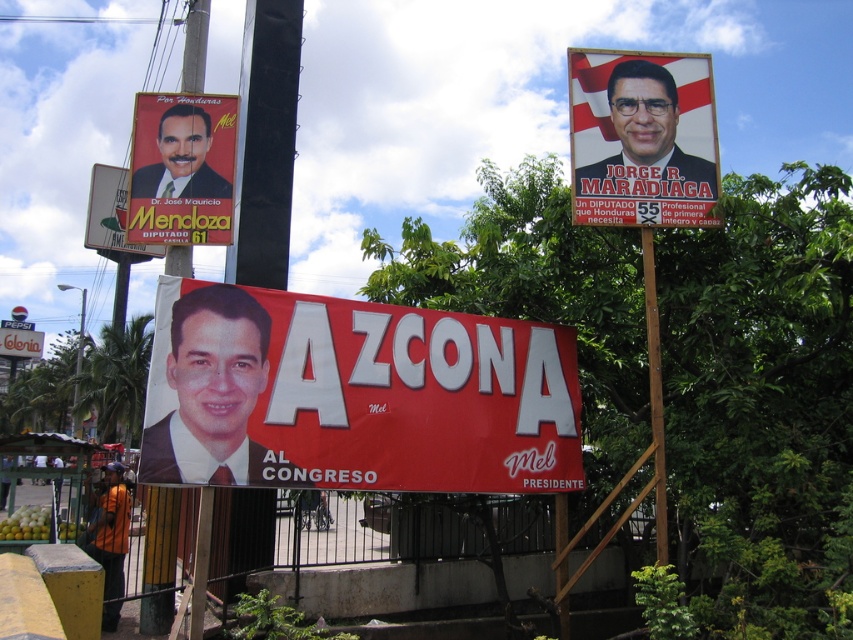
Does matte red banner at center appear under matte black poster at upper left?

Indeed, matte red banner at center is positioned under matte black poster at upper left.

Who is more forward, (186, 333) or (215, 237)?

Point (186, 333)

Does point (178, 308) come farther from viewer compared to point (149, 164)?

That is False.

Locate an element on the screen. The height and width of the screenshot is (640, 853). matte red banner at center is located at coordinates (354, 396).

Does matte black poster at upper left have a smaller size compared to matte black banner at lower left?

Correct, matte black poster at upper left occupies less space than matte black banner at lower left.

Between matte black poster at upper left and matte black banner at lower left, which one is positioned higher?

matte black poster at upper left is above.

Is point (149, 120) more distant than point (15, 348)?

No, (149, 120) is closer to viewer.

I want to click on matte black poster at upper left, so click(183, 168).

Measure the distance between point (103,586) and camera.

Point (103,586) and camera are 5.32 meters apart.

You are a GUI agent. You are given a task and a screenshot of the screen. Output one action in this format:
    pyautogui.click(x=<x>, y=<y>)
    Task: Click on the orange fabric jacket at lower left
    The image size is (853, 640).
    Given the screenshot: What is the action you would take?
    pyautogui.click(x=109, y=540)

I want to click on orange fabric jacket at lower left, so click(109, 540).